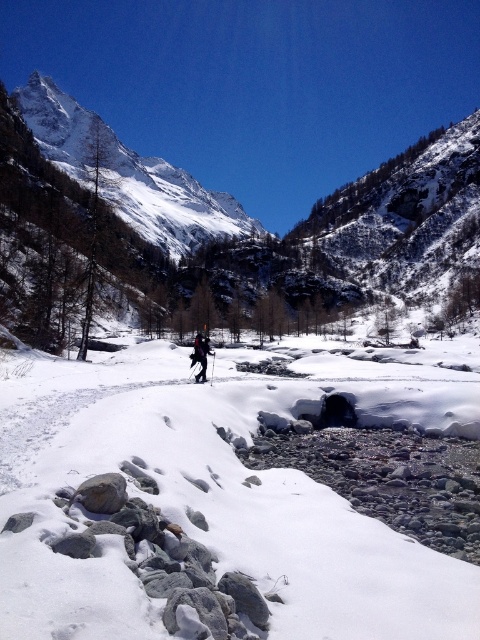
Does white powder snow at center appear under gray rock at lower left?

Incorrect, white powder snow at center is not positioned below gray rock at lower left.

Is point (34, 520) farther from camera compared to point (104, 483)?

That is False.

Locate an element on the screen. white powder snow at center is located at coordinates coord(225,497).

The height and width of the screenshot is (640, 480). Find the location of `white powder snow at center`. white powder snow at center is located at coordinates (225, 497).

Who is positioned more to the right, snowy granite mountain at upper center or black matte ski at center?

snowy granite mountain at upper center is more to the right.

Does point (193, 310) come closer to viewer compared to point (204, 378)?

No, (193, 310) is further to viewer.

Where is `snowy granite mountain at upper center`? The width and height of the screenshot is (480, 640). snowy granite mountain at upper center is located at coordinates point(219,230).

Does gray rock at lower left have a smaller size compared to black matte ski at center?

Incorrect, gray rock at lower left is not smaller in size than black matte ski at center.

Which is behind, point (110, 497) or point (203, 381)?

The point (203, 381) is behind.

What are the coordinates of `gray rock at lower left` in the screenshot? It's located at (101, 493).